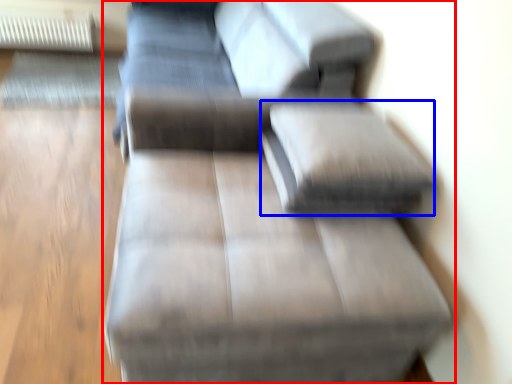
Question: Which point is closer to the camera, studio couch (highlighted by a red box) or pillow (highlighted by a blue box)?

Choices:
 (A) studio couch
 (B) pillow

Answer: (A)